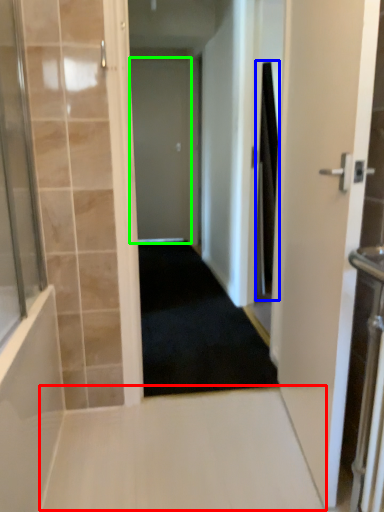
Question: Which object is the farthest from path (highlighted by a red box)? Choose among these: shower curtain (highlighted by a blue box) or door (highlighted by a green box).

Choices:
 (A) shower curtain
 (B) door

Answer: (B)